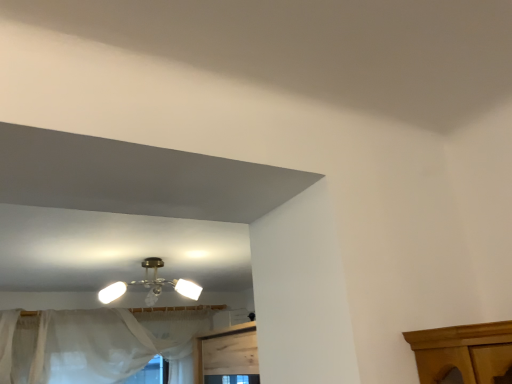
Question: Visually, is sheer white curtain at lower left positioned to the left or to the right of metallic brass chandelier at center?

Choices:
 (A) left
 (B) right

Answer: (A)

Question: Does point (129, 369) appear closer or farther from the camera than point (176, 289)?

Choices:
 (A) closer
 (B) farther

Answer: (B)

Question: From a real-world perspective, is sheer white curtain at lower left above or below metallic brass chandelier at center?

Choices:
 (A) below
 (B) above

Answer: (A)

Question: From the image's perspective, is metallic brass chandelier at center positioned above or below sheer white curtain at lower left?

Choices:
 (A) above
 (B) below

Answer: (A)

Question: Is metallic brass chandelier at center bigger or smaller than sheer white curtain at lower left?

Choices:
 (A) big
 (B) small

Answer: (B)

Question: Is metallic brass chandelier at center wider or thinner than sheer white curtain at lower left?

Choices:
 (A) thin
 (B) wide

Answer: (B)

Question: Considering the positions of metallic brass chandelier at center and sheer white curtain at lower left in the image, is metallic brass chandelier at center taller or shorter than sheer white curtain at lower left?

Choices:
 (A) short
 (B) tall

Answer: (A)